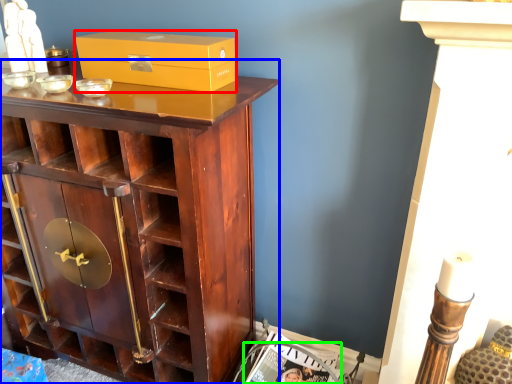
Question: Which object is positioned closest to box (highlighted by a red box)? Select from cupboard (highlighted by a blue box) and magazine (highlighted by a green box).

Choices:
 (A) cupboard
 (B) magazine

Answer: (A)